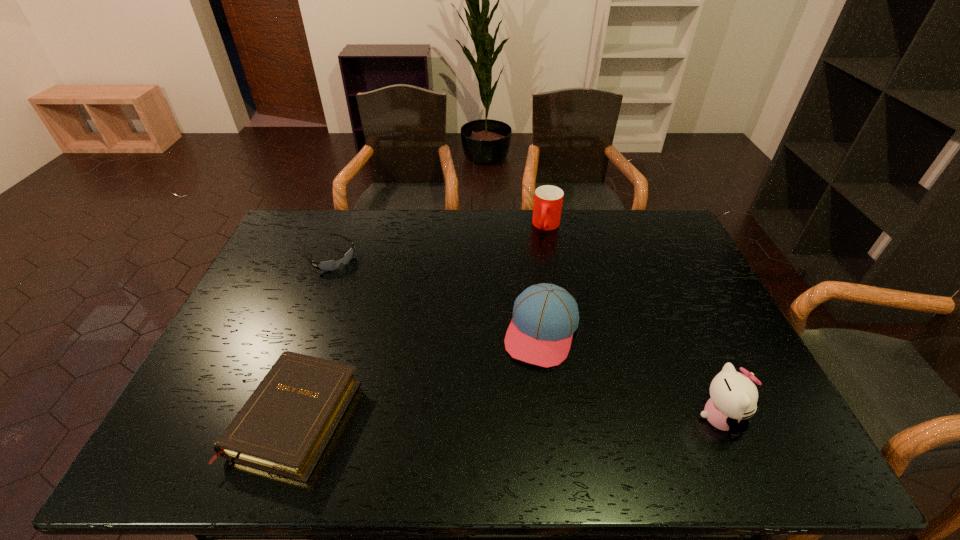
At what (x,y) coordinates should I click in order to perform the action: click on free space at the right edge. Please return your answer as a coordinate pair (x, y). This screenshot has width=960, height=540. Looking at the image, I should click on (685, 249).

This screenshot has width=960, height=540. Find the location of `free space at the far left corner of the desktop`. free space at the far left corner of the desktop is located at coordinates pos(303,211).

Where is `vacant space at the far right corner of the desktop`? The width and height of the screenshot is (960, 540). vacant space at the far right corner of the desktop is located at coordinates (683, 240).

Locate an element on the screen. The height and width of the screenshot is (540, 960). vacant space that is in between the cup and the sunglasses is located at coordinates (439, 241).

You are a GUI agent. You are given a task and a screenshot of the screen. Output one action in this format:
    pyautogui.click(x=<x>, y=<y>)
    Task: Click on the vacant space that is in between the tallest object and the Bible
    The width and height of the screenshot is (960, 540).
    Given the screenshot: What is the action you would take?
    pyautogui.click(x=508, y=417)

Identify the location of vacant space that is in between the Bible and the second farthest object. (313, 336).

Where is `free area in between the cup and the second shortest object`? free area in between the cup and the second shortest object is located at coordinates (421, 321).

At what (x,y) coordinates should I click in order to perform the action: click on free point between the kitten and the cup. Please return your answer as a coordinate pair (x, y). The image size is (960, 540). Looking at the image, I should click on (x=634, y=322).

The image size is (960, 540). I want to click on unoccupied area between the fourth tallest object and the second farthest object, so click(x=313, y=336).

I want to click on empty location between the kitten and the farthest object, so [x=634, y=322].